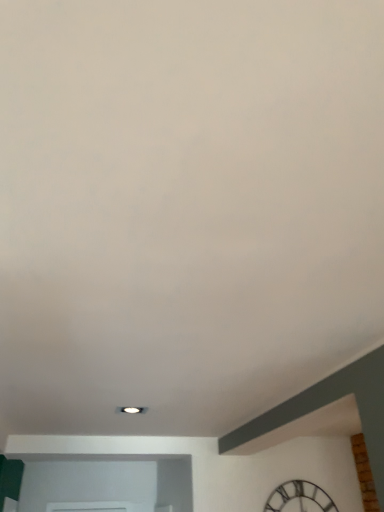
The width and height of the screenshot is (384, 512). What do you see at coordinates (299, 498) in the screenshot?
I see `metallic silver clock at lower right` at bounding box center [299, 498].

Find the location of a particular element. metallic silver clock at lower right is located at coordinates (299, 498).

Where is `metallic silver clock at lower right`? The height and width of the screenshot is (512, 384). metallic silver clock at lower right is located at coordinates (299, 498).